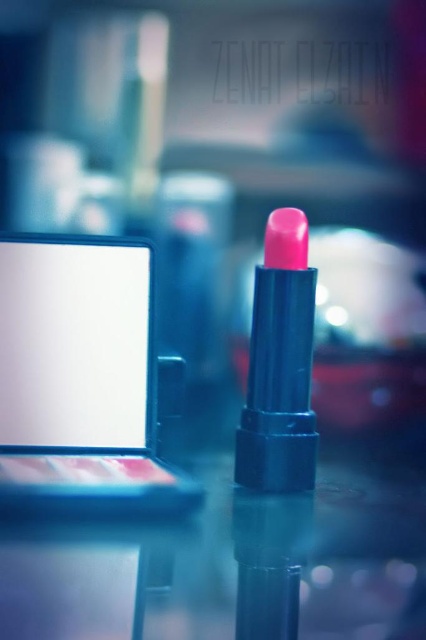
Which is below, white matte screen at center or matte pink lipstick at center?

matte pink lipstick at center

Does white matte screen at center appear on the left side of matte pink lipstick at center?

Correct, you'll find white matte screen at center to the left of matte pink lipstick at center.

Which is behind, point (45, 378) or point (284, 296)?

The point (284, 296) is more distant.

Identify the location of white matte screen at center. The height and width of the screenshot is (640, 426). (74, 344).